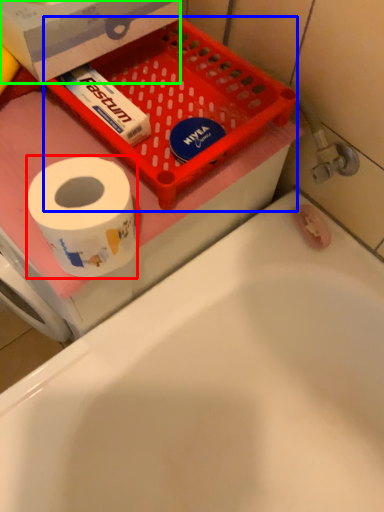
Question: Estimate the real-world distances between objects in this image. Which object is closer to toilet paper (highlighted by a red box), basket (highlighted by a blue box) or box (highlighted by a green box)?

Choices:
 (A) basket
 (B) box

Answer: (A)